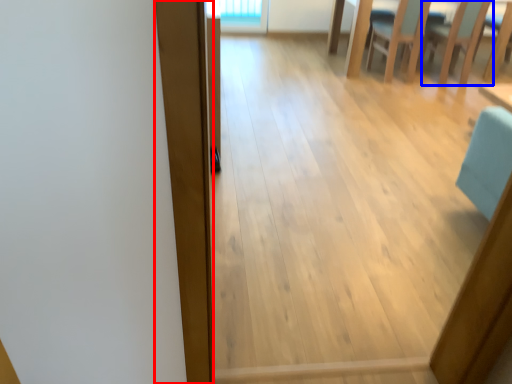
Question: Which object appears closest to the camera in this image, plank (highlighted by a red box) or armchair (highlighted by a blue box)?

Choices:
 (A) plank
 (B) armchair

Answer: (A)